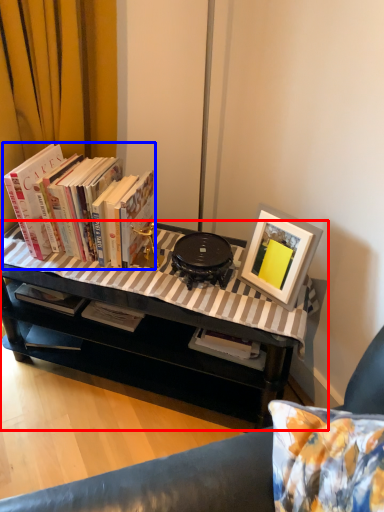
Question: Among these objects, which one is nearest to the camera, table (highlighted by a red box) or book (highlighted by a blue box)?

Choices:
 (A) table
 (B) book

Answer: (A)